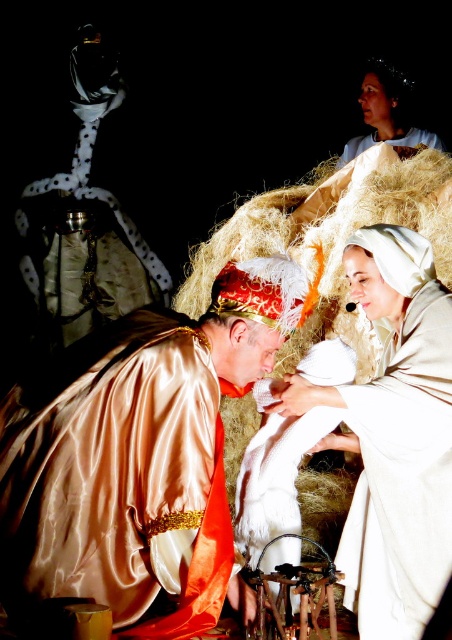
Question: Which point appears farthest from the camera in this image?

Choices:
 (A) (428, 145)
 (B) (230, 552)

Answer: (A)

Question: Can you confirm if smooth white cloth at upper center is positioned above white cotton robe at upper center?

Choices:
 (A) no
 (B) yes

Answer: (B)

Question: Does smooth white cloth at upper center have a smaller size compared to white cotton robe at upper center?

Choices:
 (A) no
 (B) yes

Answer: (A)

Question: Which point is closer to the camera?

Choices:
 (A) white cotton robe at upper center
 (B) white linen cloth at center
 (C) satin gold robe at center

Answer: (C)

Question: Can you confirm if white linen cloth at center is positioned above smooth white cloth at upper center?

Choices:
 (A) no
 (B) yes

Answer: (A)

Question: Which of the following is the farthest from the observer?

Choices:
 (A) 381,525
 (B) 370,132
 (C) 415,134
 (D) 186,458

Answer: (B)